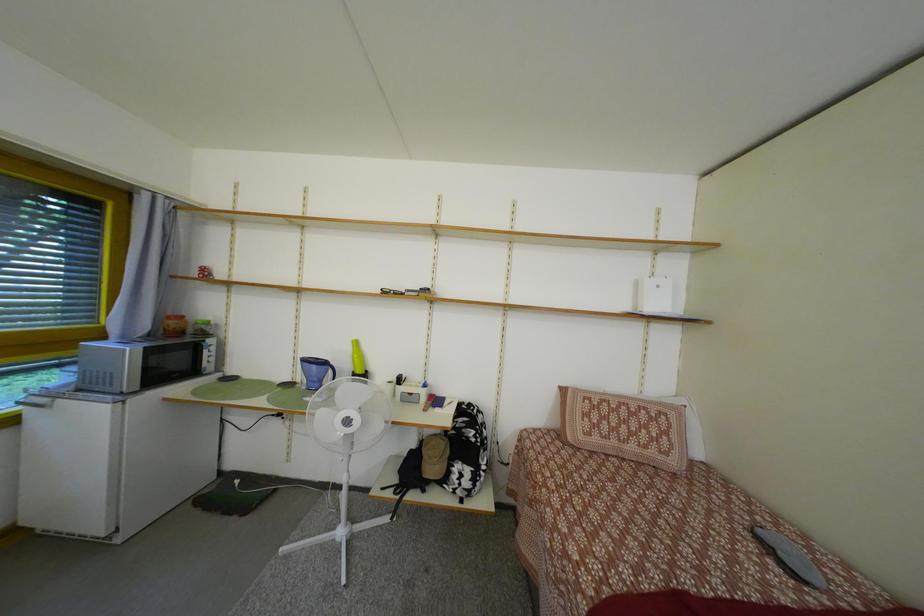
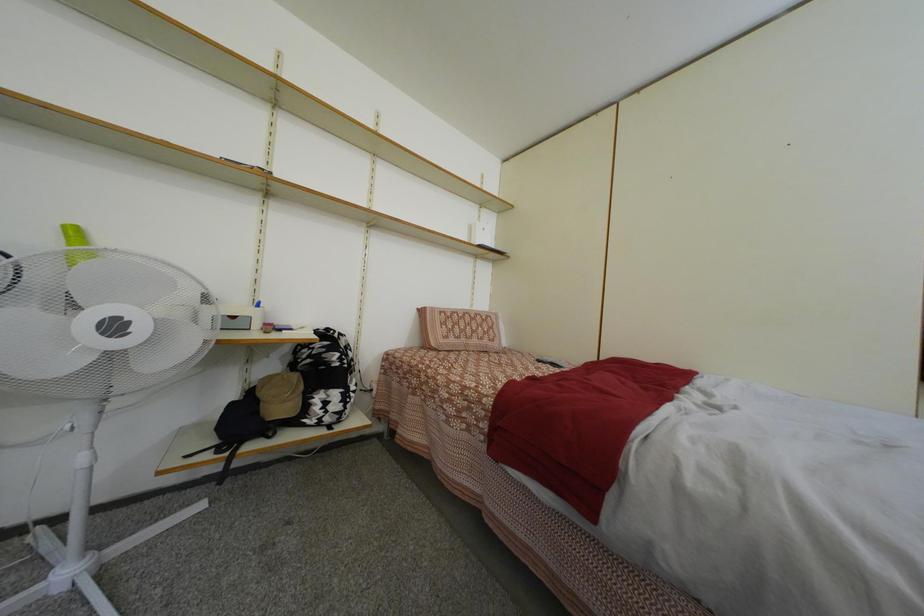
Question: The first image is from the beginning of the video and the second image is from the end. How did the camera likely rotate when shooting the video?

Choices:
 (A) Left
 (B) Right
 (C) Up
 (D) Down

Answer: (B)